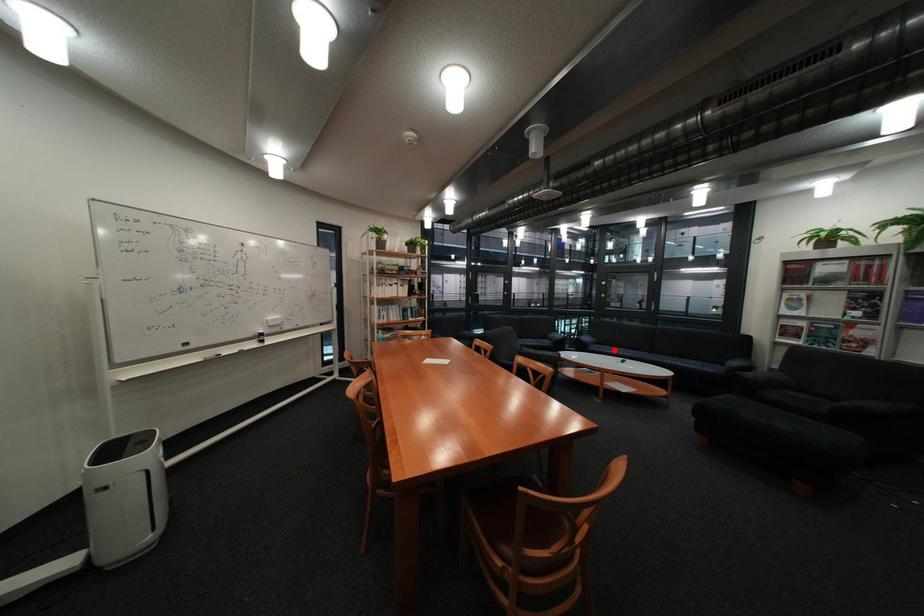
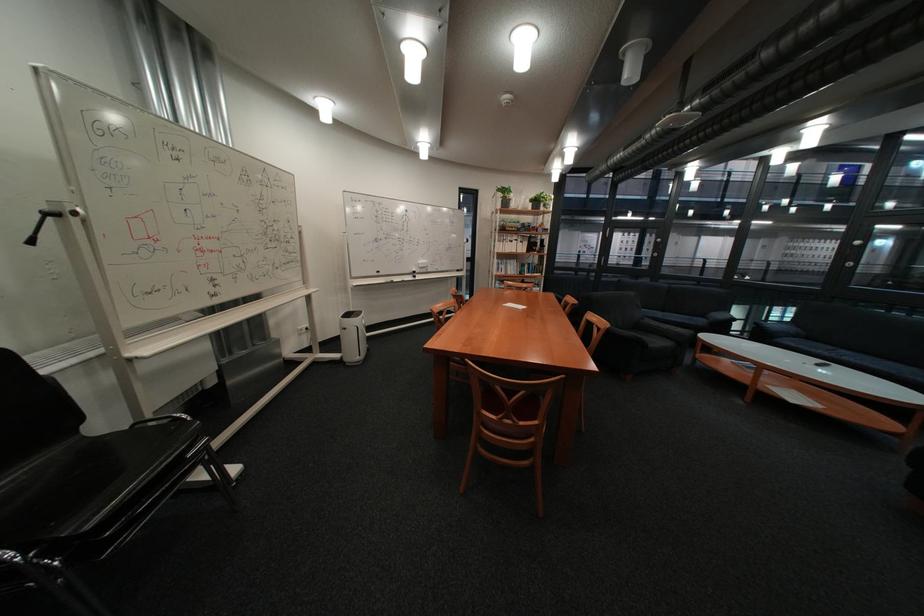
Where in the second image is the point corresponding to the highlighted location from the first image?

(808, 345)